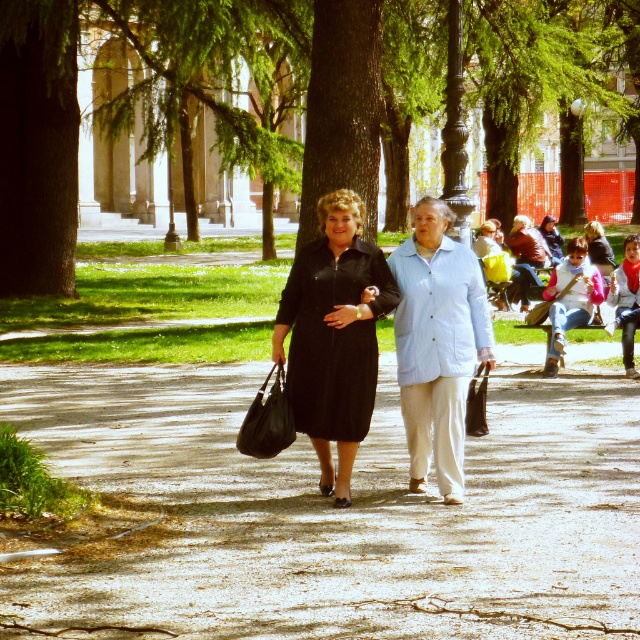
You are a drone operator trying to capture a photo of the two women walking along the path. The drone is currently hovering above the dull concrete pavement at center. To ensure the women are in frame, you need to adjust the drone to face towards them. In which direction should you tilt the drone to capture the women?

The women are walking along the dull concrete pavement at center, so the drone should be tilted downward to capture them since the pavement is at a lower point compared to the drone.

Please look at the image and identify the object located at the coordinates point (333, 509). Based on the scene description, what is the material and color of this object?

The point (333, 509) indicates dull concrete pavement at center, so the material is concrete and the color is dull.

You are a park visitor who wants to stay cool in the shade while walking on the dull concrete pavement at center. Can you walk under the green leafy tree at center to stay shaded?

The dull concrete pavement at center is positioned under the green leafy tree at center, so yes, walking on the dull concrete pavement at center will keep you shaded under the green leafy tree at center.